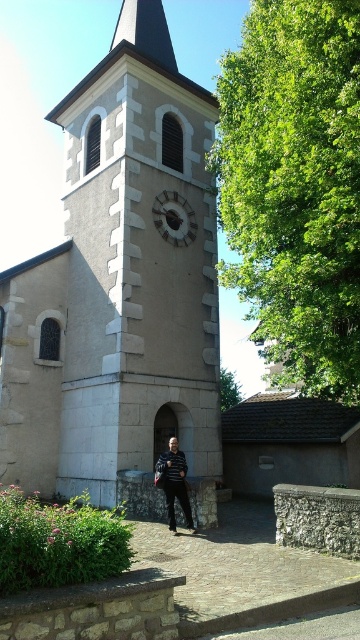
Question: Can you confirm if stone clock tower at center is bigger than matte gray clock at center?

Choices:
 (A) no
 (B) yes

Answer: (B)

Question: Among these objects, which one is nearest to the camera?

Choices:
 (A) matte gray clock at center
 (B) striped sweater at center
 (C) stone clock tower at center

Answer: (B)

Question: Can you confirm if stone clock tower at center is positioned below matte gray clock at center?

Choices:
 (A) no
 (B) yes

Answer: (B)

Question: Which of these objects is positioned farthest from the striped sweater at center?

Choices:
 (A) stone clock tower at center
 (B) matte gray clock at center

Answer: (B)

Question: Is stone clock tower at center positioned in front of matte gray clock at center?

Choices:
 (A) no
 (B) yes

Answer: (B)

Question: Among these objects, which one is nearest to the camera?

Choices:
 (A) matte gray clock at center
 (B) stone clock tower at center

Answer: (B)